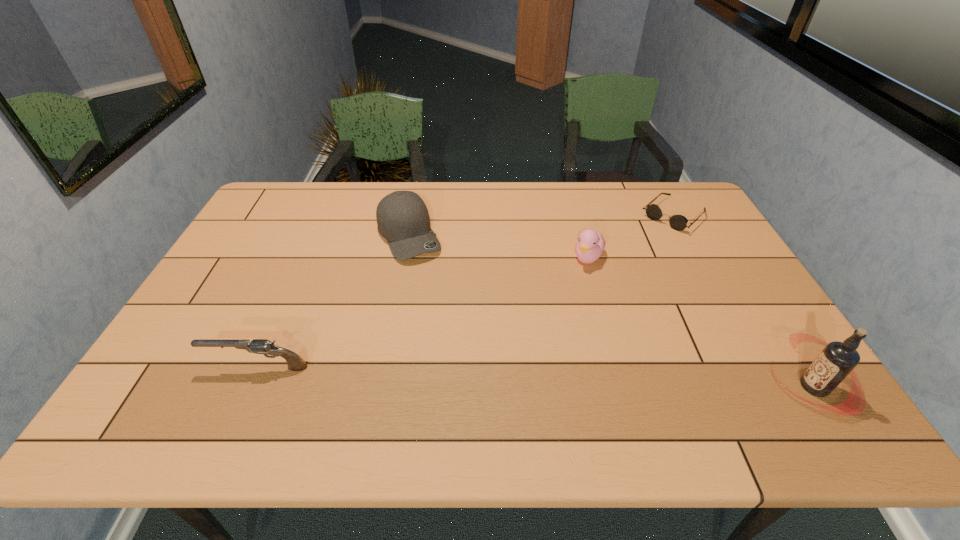
At what (x,y) coordinates should I click in order to perform the action: click on free spot located on the front-facing side of the sunglasses. Please return your answer as a coordinate pair (x, y). Looking at the image, I should click on (637, 249).

In order to click on baseball cap located in the far edge section of the desktop in this screenshot , I will do `click(403, 219)`.

I want to click on sunglasses located in the far edge section of the desktop, so click(678, 222).

Locate an element on the screen. The height and width of the screenshot is (540, 960). gun at the near edge is located at coordinates (258, 346).

Locate an element on the screen. root beer present at the near edge is located at coordinates (838, 359).

What are the coordinates of `object that is at the left edge` in the screenshot? It's located at (258, 346).

Where is `root beer that is at the right edge`? Image resolution: width=960 pixels, height=540 pixels. root beer that is at the right edge is located at coordinates (838, 359).

Identify the location of sunglasses at the right edge. (678, 222).

Locate an element on the screen. This screenshot has height=540, width=960. object that is at the near left corner is located at coordinates (258, 346).

Locate an element on the screen. This screenshot has width=960, height=540. object located at the far right corner is located at coordinates (678, 222).